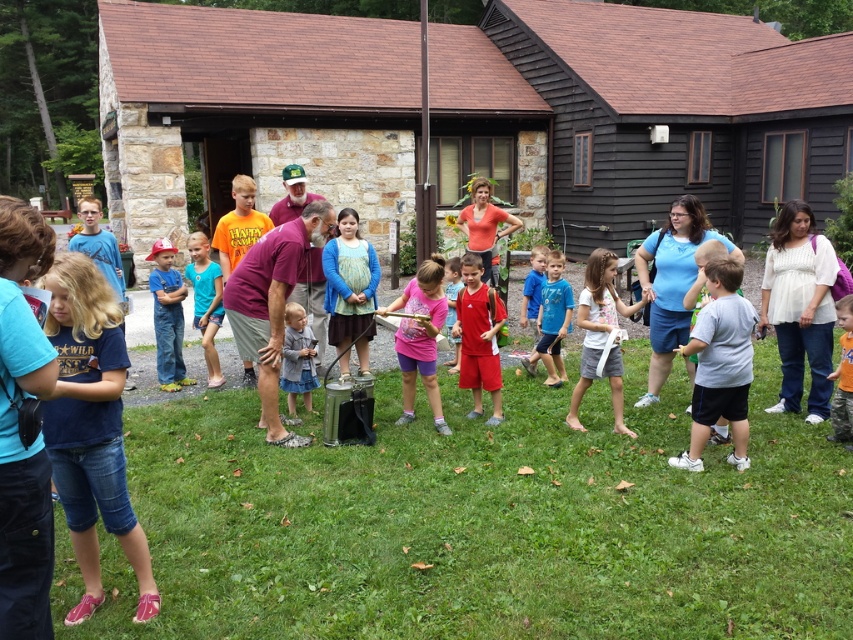
Can you confirm if blue denim shorts at lower left is thinner than gray matte shirt at center?

Yes.

Can you confirm if blue denim shorts at lower left is positioned above gray matte shirt at center?

Actually, blue denim shorts at lower left is below gray matte shirt at center.

Is point (93, 435) positioned in front of point (735, 280)?

Yes, it is.

Identify the location of blue denim shorts at lower left. (x=91, y=426).

Does point (447, 148) lie behind point (569, 93)?

Yes.

Can you confirm if brown stone hut at center is positioned below dark brown wooden hut at center?

Yes, brown stone hut at center is below dark brown wooden hut at center.

The width and height of the screenshot is (853, 640). I want to click on brown stone hut at center, so click(x=254, y=109).

You are a GUI agent. You are given a task and a screenshot of the screen. Output one action in this format:
    pyautogui.click(x=<x>, y=<y>)
    Task: Click on the brown stone hut at center
    The height and width of the screenshot is (640, 853).
    Given the screenshot: What is the action you would take?
    pyautogui.click(x=254, y=109)

Does brown stone hut at center appear on the left side of blue cotton shirt at center?

Correct, you'll find brown stone hut at center to the left of blue cotton shirt at center.

Does brown stone hut at center have a smaller size compared to blue cotton shirt at center?

Incorrect, brown stone hut at center is not smaller in size than blue cotton shirt at center.

The width and height of the screenshot is (853, 640). What are the coordinates of `brown stone hut at center` in the screenshot? It's located at (254, 109).

At what (x,y) coordinates should I click in order to perform the action: click on brown stone hut at center. Please return your answer as a coordinate pair (x, y). The image size is (853, 640). Looking at the image, I should click on (254, 109).